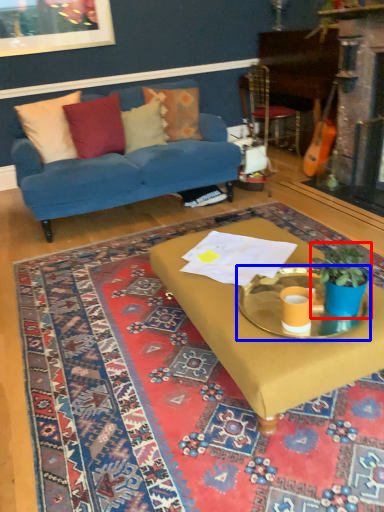
Question: Which of the following is the closest to the observer, houseplant (highlighted by a red box) or round table (highlighted by a blue box)?

Choices:
 (A) houseplant
 (B) round table

Answer: (A)